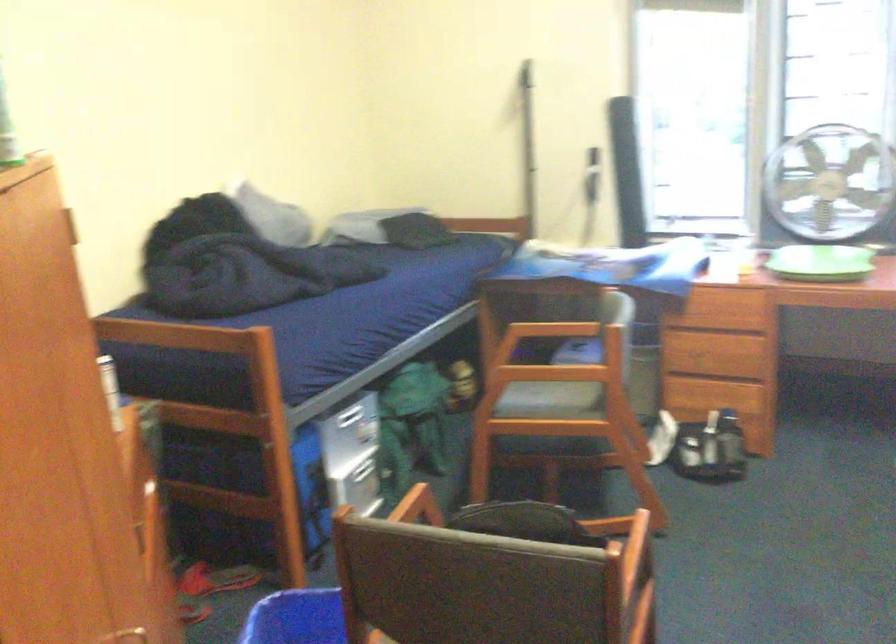
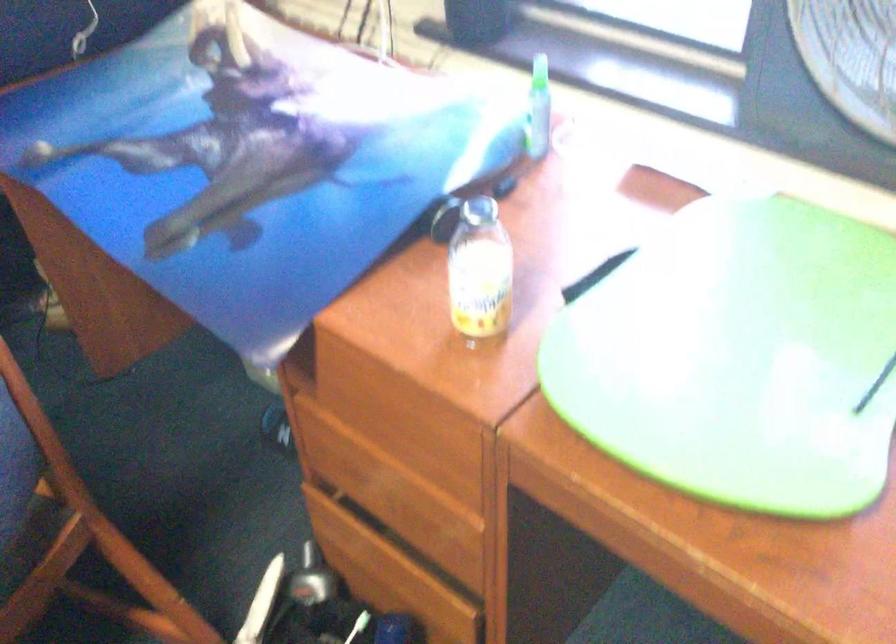
In a continuous first-person perspective shot, in which direction is the camera moving?

The movement direction of the cameraman is right, forward.